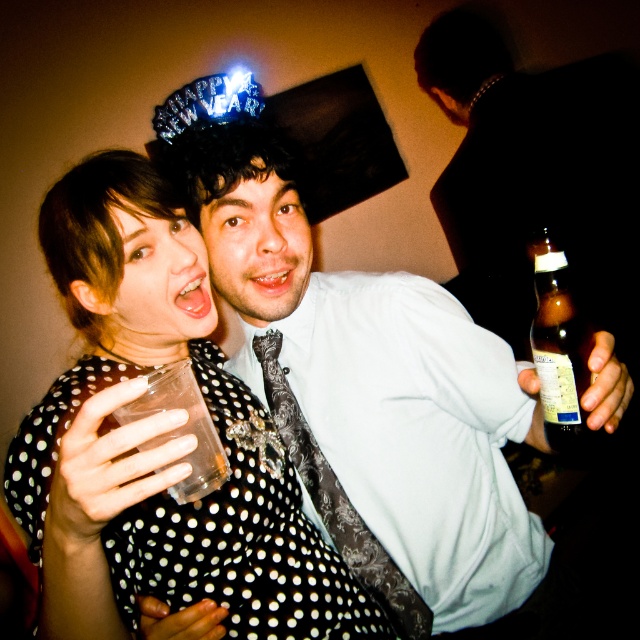
Is black satin tie at center thinner than brown glass bottle at right?

Yes.

Between black satin tie at center and brown glass bottle at right, which one has more height?

black satin tie at center

Between point (273, 417) and point (538, 282), which one is positioned in front?

Point (538, 282) is in front.

At what (x,y) coordinates should I click in order to perform the action: click on black satin tie at center. Please return your answer as a coordinate pair (x, y). The image size is (640, 640). Looking at the image, I should click on (337, 500).

Which is more to the right, matte black shirt at center or black dotted fabric dress at center?

Positioned to the right is matte black shirt at center.

Is matte black shirt at center bigger than black dotted fabric dress at center?

Correct, matte black shirt at center is larger in size than black dotted fabric dress at center.

Which is in front, point (461, 577) or point (305, 628)?

Point (305, 628) is more forward.

At what (x,y) coordinates should I click in order to perform the action: click on matte black shirt at center. Please return your answer as a coordinate pair (x, y). This screenshot has width=640, height=640. Looking at the image, I should click on (362, 380).

In the scene shown: Can you confirm if black dotted fabric dress at center is positioned above black satin tie at center?

Yes, black dotted fabric dress at center is above black satin tie at center.

The image size is (640, 640). In order to click on black dotted fabric dress at center in this screenshot , I will do `click(240, 538)`.

Find the location of a particular element. black dotted fabric dress at center is located at coordinates (240, 538).